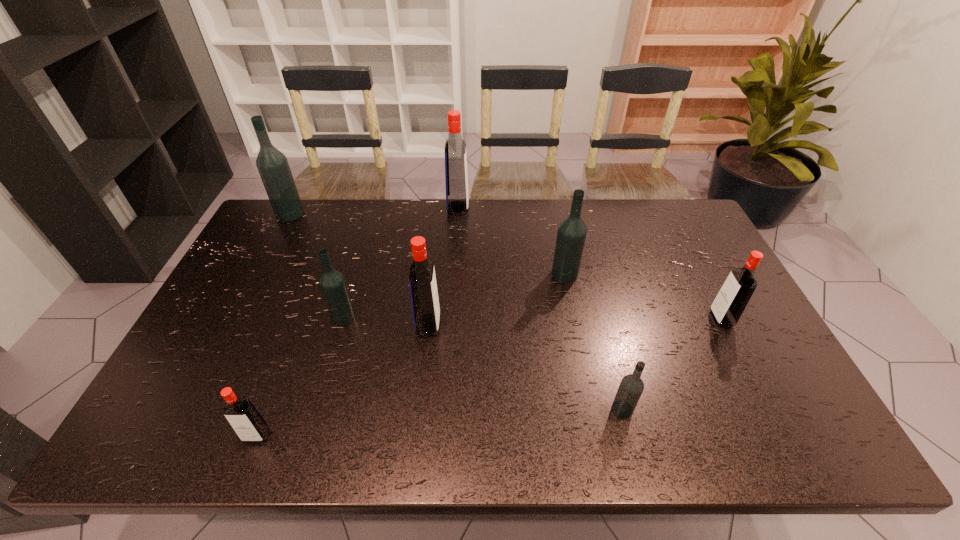
The width and height of the screenshot is (960, 540). In order to click on free space between the biggest red vodka and the sixth object from right to left in this screenshot , I will do `click(400, 262)`.

Identify the location of object that ranks as the seventh closest to the seventh farthest vodka. The image size is (960, 540). (273, 167).

Choose which object is the second nearest neighbor to the nearest object. Please provide its 2D coordinates. Your answer should be formatted as a tuple, i.e. [(x, y)], where the tuple contains the x and y coordinates of a point satisfying the conditions above.

[(423, 288)]

The image size is (960, 540). Identify the location of the closest vodka to the farthest black vodka. (332, 282).

You are a GUI agent. You are given a task and a screenshot of the screen. Output one action in this format:
    pyautogui.click(x=<x>, y=<y>)
    Task: Click on the vodka that can be found as the fifth closest to the biggest red vodka
    The image size is (960, 540).
    Given the screenshot: What is the action you would take?
    631,387

The width and height of the screenshot is (960, 540). I want to click on red vodka that is the third closest one to the seventh vodka from left to right, so click(x=250, y=426).

Locate which red vodka ranks third in proximity to the nearest black vodka. Please provide its 2D coordinates. Your answer should be formatted as a tuple, i.e. [(x, y)], where the tuple contains the x and y coordinates of a point satisfying the conditions above.

[(250, 426)]

Identify which black vodka is the third nearest to the rightmost object. Please provide its 2D coordinates. Your answer should be formatted as a tuple, i.e. [(x, y)], where the tuple contains the x and y coordinates of a point satisfying the conditions above.

[(332, 282)]

Find the location of a particular element. the closest black vodka to the biggest red vodka is located at coordinates (571, 235).

This screenshot has width=960, height=540. I want to click on vacant area that satisfies the following two spatial constraints: 1. on the front and back of the rightmost red vodka; 2. on the front and back of the nearest vodka, so click(x=781, y=435).